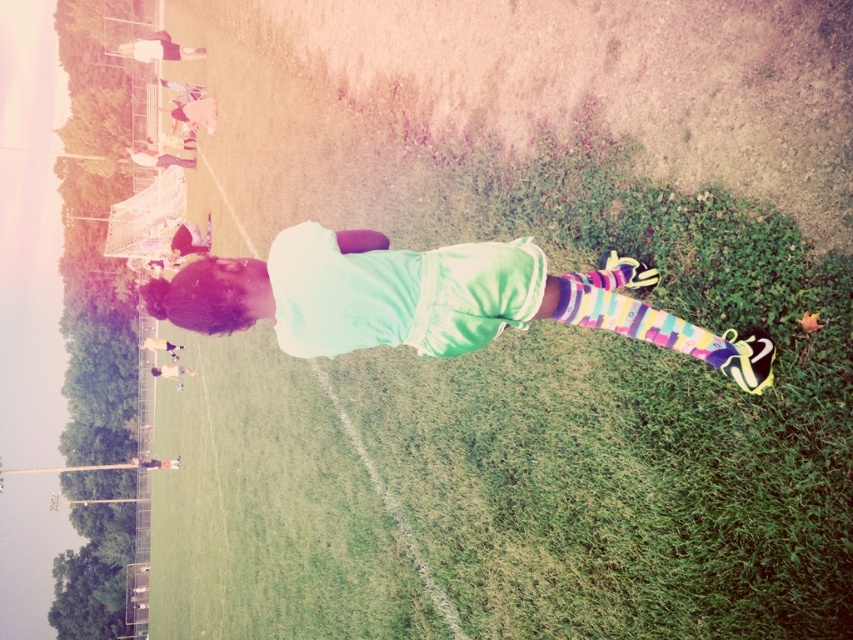
You are a photographer trying to capture the white matte shirt at center and the multicolored knitted sock at lower right in a single frame. Based on their positions, will you need to adjust your camera angle upwards or downwards to include both objects?

The white matte shirt at center is located above the multicolored knitted sock at lower right, so you will need to adjust your camera angle downwards to include both objects.

Consider the image. You are looking at the image and notice a point marked at coordinates [422,298]. Based on the scene description, what object or part of the scene is located at this point?

The point at coordinates [422,298] is located on the white matte shirt at center.

You are a photographer trying to capture the white matte shirt at center and the multicolored knitted sock at lower right in the same frame. Since the image is rotated, you need to adjust your camera angle. Which object should you focus on first to ensure both are in the frame?

The white matte shirt at center is in front of the multicolored knitted sock at lower right, so you should focus on the white matte shirt at center first to ensure both are in the frame.